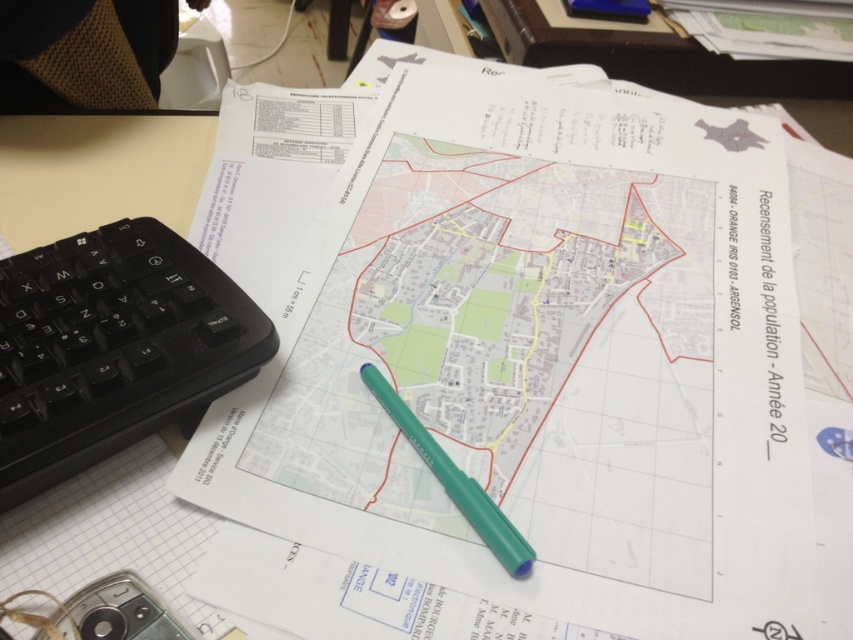
Can you confirm if white paper at center is wider than black plastic keyboard at lower left?

Yes, white paper at center is wider than black plastic keyboard at lower left.

Does white paper at center lie in front of black plastic keyboard at lower left?

Yes, white paper at center is closer to the viewer.

The image size is (853, 640). I want to click on white paper at center, so click(x=550, y=371).

Which is more to the left, black plastic keyboard at lower left or green plastic pen at center?

black plastic keyboard at lower left

Is black plastic keyboard at lower left positioned behind green plastic pen at center?

That is False.

Who is more distant from viewer, [71,237] or [491,538]?

The point [71,237] is behind.

You are a GUI agent. You are given a task and a screenshot of the screen. Output one action in this format:
    pyautogui.click(x=<x>, y=<y>)
    Task: Click on the black plastic keyboard at lower left
    Image resolution: width=853 pixels, height=640 pixels.
    Given the screenshot: What is the action you would take?
    pyautogui.click(x=112, y=348)

Is white paper at center positioned at the back of green plastic pen at center?

That is False.

Does white paper at center appear on the right side of green plastic pen at center?

Correct, you'll find white paper at center to the right of green plastic pen at center.

Does point (722, 365) come in front of point (474, 500)?

No, (722, 365) is behind (474, 500).

The height and width of the screenshot is (640, 853). In order to click on white paper at center in this screenshot , I will do `click(550, 371)`.